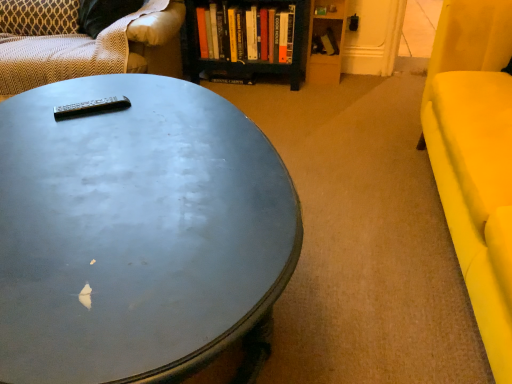
The width and height of the screenshot is (512, 384). I want to click on hardcover book at center, so click(245, 33).

This screenshot has width=512, height=384. What do you see at coordinates (245, 33) in the screenshot? I see `hardcover book at center` at bounding box center [245, 33].

At what (x,y) coordinates should I click in order to perform the action: click on black plastic remote at center. Please return your answer as a coordinate pair (x, y). Looking at the image, I should click on (91, 107).

Describe the element at coordinates (85, 43) in the screenshot. I see `patterned fabric studio couch at upper left` at that location.

This screenshot has height=384, width=512. Find the location of `hardcover book at center`. hardcover book at center is located at coordinates (245, 33).

Find the location of `book behind the black plastic remote at center`. book behind the black plastic remote at center is located at coordinates (245, 33).

Considering the points (125, 105) and (273, 27), which point is behind, point (125, 105) or point (273, 27)?

The point (273, 27) is farther.

Can you confirm if black plastic remote at center is shorter than hardcover book at center?

Indeed, black plastic remote at center has a lesser height compared to hardcover book at center.

Considering the positions of objects patterned fabric studio couch at upper left and hardcover book at center in the image provided, who is behind, patterned fabric studio couch at upper left or hardcover book at center?

hardcover book at center is further from the camera.

From a real-world perspective, is patterned fabric studio couch at upper left on hardcover book at center?

Yes.

From the picture: From the image's perspective, does patterned fabric studio couch at upper left appear lower than hardcover book at center?

Correct, patterned fabric studio couch at upper left appears lower than hardcover book at center in the image.

Looking at the image, does patterned fabric studio couch at upper left seem bigger or smaller compared to hardcover book at center?

In the image, patterned fabric studio couch at upper left appears to be larger than hardcover book at center.

From a real-world perspective, is patterned fabric pillow at upper left below black plastic remote at center?

Yes.

How much distance is there between patterned fabric pillow at upper left and black plastic remote at center?

patterned fabric pillow at upper left is 1.19 meters from black plastic remote at center.

You are a GUI agent. You are given a task and a screenshot of the screen. Output one action in this format:
    pyautogui.click(x=<x>, y=<y>)
    Task: Click on the pillow that is under the black plastic remote at center (from a real-world perspective)
    The image size is (512, 384).
    Given the screenshot: What is the action you would take?
    pyautogui.click(x=39, y=17)

Looking at this image, how different are the orientations of patterned fabric pillow at upper left and black plastic remote at center in degrees?

64.7 degrees separate the facing orientations of patterned fabric pillow at upper left and black plastic remote at center.

Based on the photo, does patterned fabric pillow at upper left touch metallic gray coffee table at center?

No, patterned fabric pillow at upper left is not in contact with metallic gray coffee table at center.

Looking at their sizes, would you say patterned fabric pillow at upper left is wider or thinner than metallic gray coffee table at center?

patterned fabric pillow at upper left is thinner than metallic gray coffee table at center.

Is patterned fabric pillow at upper left oriented away from metallic gray coffee table at center?

No, patterned fabric pillow at upper left's orientation is not away from metallic gray coffee table at center.

Based on the photo, could patterned fabric studio couch at upper left be considered to be inside patterned fabric pillow at upper left?

No.

From the image's perspective, which is above, patterned fabric pillow at upper left or patterned fabric studio couch at upper left?

patterned fabric pillow at upper left, from the image's perspective.

Does point (24, 13) come closer to viewer compared to point (39, 51)?

That is False.

From the image's perspective, which is below, matte yellow armchair at right or black plastic remote at center?

From the image's view, matte yellow armchair at right is below.

Does matte yellow armchair at right have a lesser width compared to black plastic remote at center?

No.

Is black plastic remote at center at the back of matte yellow armchair at right?

No.

Considering the sizes of objects metallic gray coffee table at center and black plastic remote at center in the image provided, who is wider, metallic gray coffee table at center or black plastic remote at center?

With larger width is metallic gray coffee table at center.

From a real-world perspective, between metallic gray coffee table at center and black plastic remote at center, who is vertically lower?

metallic gray coffee table at center, from a real-world perspective.

How different are the orientations of metallic gray coffee table at center and black plastic remote at center in degrees?

They differ by 1.72 degrees in their facing directions.

Does metallic gray coffee table at center have a smaller size compared to black plastic remote at center?

No, metallic gray coffee table at center is not smaller than black plastic remote at center.

Where is `remote control on the left of hardcover book at center`? This screenshot has height=384, width=512. remote control on the left of hardcover book at center is located at coordinates (91, 107).

Where is `book behind the patterned fabric studio couch at upper left`? This screenshot has width=512, height=384. book behind the patterned fabric studio couch at upper left is located at coordinates (245, 33).

Estimate the real-world distances between objects in this image. Which object is further from metallic gray coffee table at center, hardcover book at center or patterned fabric pillow at upper left?

The object further to metallic gray coffee table at center is hardcover book at center.

In the scene shown: Based on their spatial positions, is patterned fabric pillow at upper left or black plastic remote at center further from patterned fabric studio couch at upper left?

The object further to patterned fabric studio couch at upper left is black plastic remote at center.

Considering their positions, is patterned fabric pillow at upper left positioned closer to hardcover book at center than patterned fabric studio couch at upper left?

patterned fabric studio couch at upper left lies closer to hardcover book at center than the other object.

From the image, which object appears to be nearer to metallic gray coffee table at center, patterned fabric pillow at upper left or patterned fabric studio couch at upper left?

patterned fabric studio couch at upper left is closer to metallic gray coffee table at center.

Based on their spatial positions, is black plastic remote at center or metallic gray coffee table at center further from patterned fabric pillow at upper left?

metallic gray coffee table at center is further to patterned fabric pillow at upper left.

Considering their positions, is patterned fabric studio couch at upper left positioned closer to patterned fabric pillow at upper left than black plastic remote at center?

Among the two, patterned fabric studio couch at upper left is located nearer to patterned fabric pillow at upper left.

Considering their positions, is metallic gray coffee table at center positioned further to patterned fabric pillow at upper left than matte yellow armchair at right?

matte yellow armchair at right.

Which object lies nearer to the anchor point black plastic remote at center, patterned fabric pillow at upper left or patterned fabric studio couch at upper left?

patterned fabric studio couch at upper left is positioned closer to the anchor black plastic remote at center.

The height and width of the screenshot is (384, 512). In order to click on studio couch between black plastic remote at center and hardcover book at center along the z-axis in this screenshot , I will do `click(85, 43)`.

The image size is (512, 384). What are the coordinates of `pillow between matte yellow armchair at right and hardcover book at center along the z-axis` in the screenshot? It's located at (39, 17).

The image size is (512, 384). I want to click on remote control positioned between metallic gray coffee table at center and hardcover book at center from near to far, so click(91, 107).

Image resolution: width=512 pixels, height=384 pixels. What are the coordinates of `pillow located between metallic gray coffee table at center and hardcover book at center in the depth direction` in the screenshot? It's located at (39, 17).